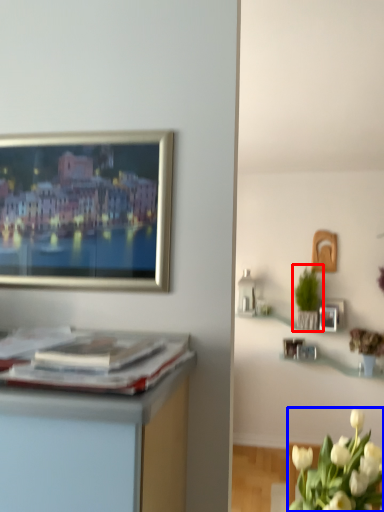
Question: Which object is closer to the camera taking this photo, houseplant (highlighted by a red box) or flower (highlighted by a blue box)?

Choices:
 (A) houseplant
 (B) flower

Answer: (B)